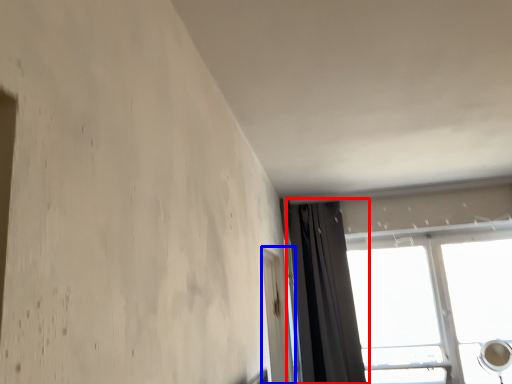
Question: Which object is closer to the camera taking this photo, curtain (highlighted by a red box) or screen door (highlighted by a blue box)?

Choices:
 (A) curtain
 (B) screen door

Answer: (B)